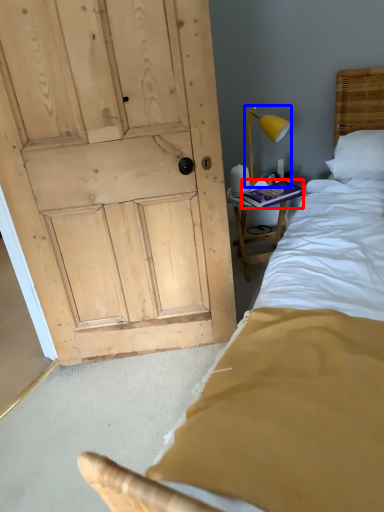
Question: Which object appears farthest to the camera in this image, book (highlighted by a red box) or bedside lamp (highlighted by a blue box)?

Choices:
 (A) book
 (B) bedside lamp

Answer: (A)